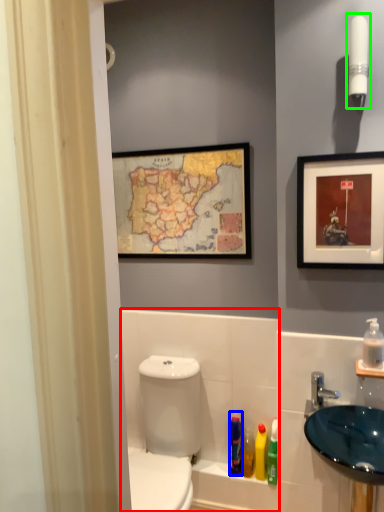
Question: Estimate the real-world distances between objects in this image. Which object is closer to bath (highlighted by a red box), mouthwash (highlighted by a blue box) or light fixture (highlighted by a green box)?

Choices:
 (A) mouthwash
 (B) light fixture

Answer: (A)